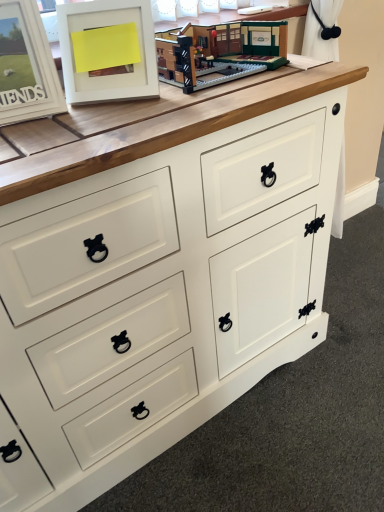
Question: From a real-world perspective, is white matte picture frame at upper left, which is counted as the 1th picture frame, starting from the right, above or below brick-like lego set at upper center?

Choices:
 (A) above
 (B) below

Answer: (A)

Question: Choose the correct answer: Is white matte picture frame at upper left, the second picture frame positioned from the left, inside brick-like lego set at upper center or outside it?

Choices:
 (A) outside
 (B) inside

Answer: (A)

Question: Estimate the real-world distances between objects in this image. Which object is closer to the brick-like lego set at upper center?

Choices:
 (A) white matte picture frame at upper left, which is the second picture frame in right-to-left order
 (B) white matte picture frame at upper left, which is counted as the 1th picture frame, starting from the right

Answer: (B)

Question: Which object is the farthest from the white matte picture frame at upper left, the first picture frame from the left?

Choices:
 (A) white matte picture frame at upper left, which is counted as the 1th picture frame, starting from the right
 (B) brick-like lego set at upper center

Answer: (B)